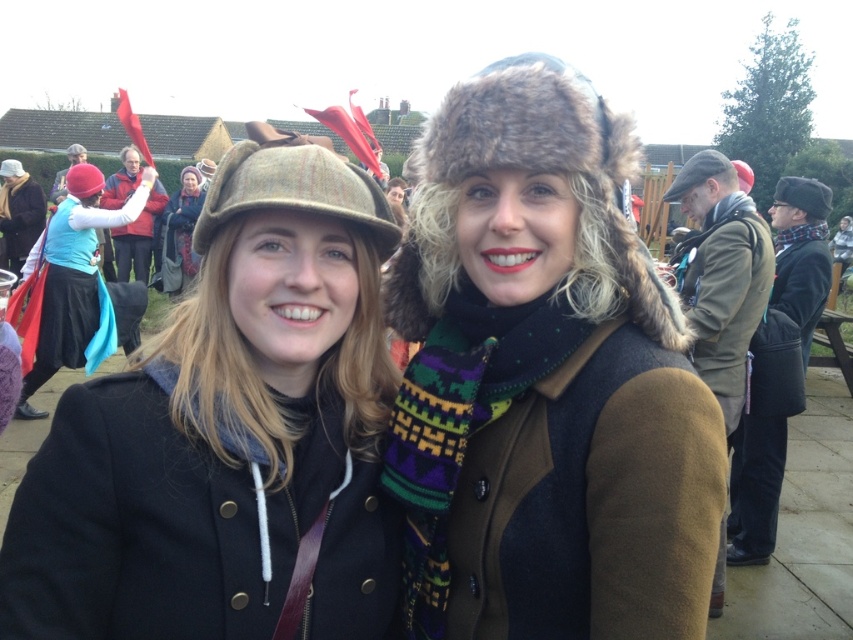
Question: Which point is farther to the camera?

Choices:
 (A) matte teal scarf at center
 (B) brown woolen hat at center

Answer: (B)

Question: Where is fuzzy brown fur hat at upper center located in relation to red fabric hat at upper left in the image?

Choices:
 (A) right
 (B) left

Answer: (A)

Question: Does matte brown hat at upper left have a lesser width compared to brown woolen hat at center?

Choices:
 (A) yes
 (B) no

Answer: (A)

Question: Is the position of knitted woolen hat at upper left less distant than that of brown woolen hat at center?

Choices:
 (A) no
 (B) yes

Answer: (B)

Question: Which object appears farthest from the camera in this image?

Choices:
 (A) brown woolen hat at center
 (B) red fuzzy hat at upper right
 (C) matte teal scarf at center

Answer: (A)

Question: Which point is farther from the camera taking this photo?

Choices:
 (A) (177, 228)
 (B) (309, 524)
 (C) (815, 214)
 (D) (80, 259)

Answer: (A)